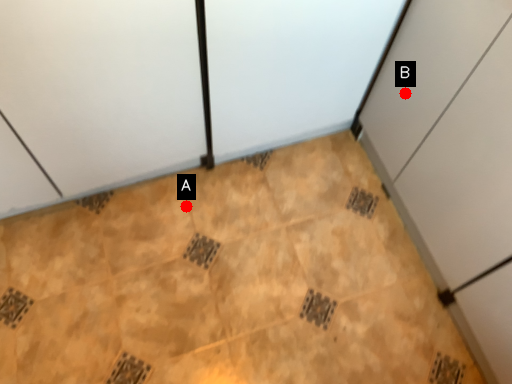
Question: Two points are circled on the image, labeled by A and B beside each circle. Which point is closer to the camera taking this photo?

Choices:
 (A) A is closer
 (B) B is closer

Answer: (B)